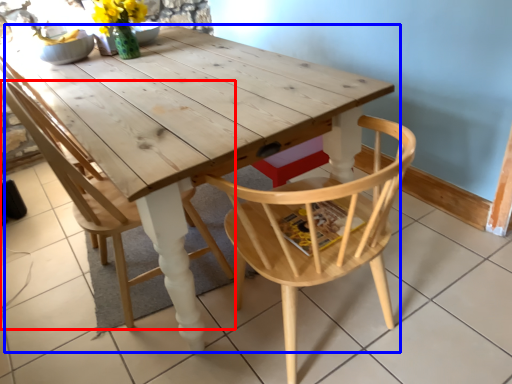
Question: Which of the following is the farthest to the observer, chair (highlighted by a red box) or table (highlighted by a blue box)?

Choices:
 (A) chair
 (B) table

Answer: (A)